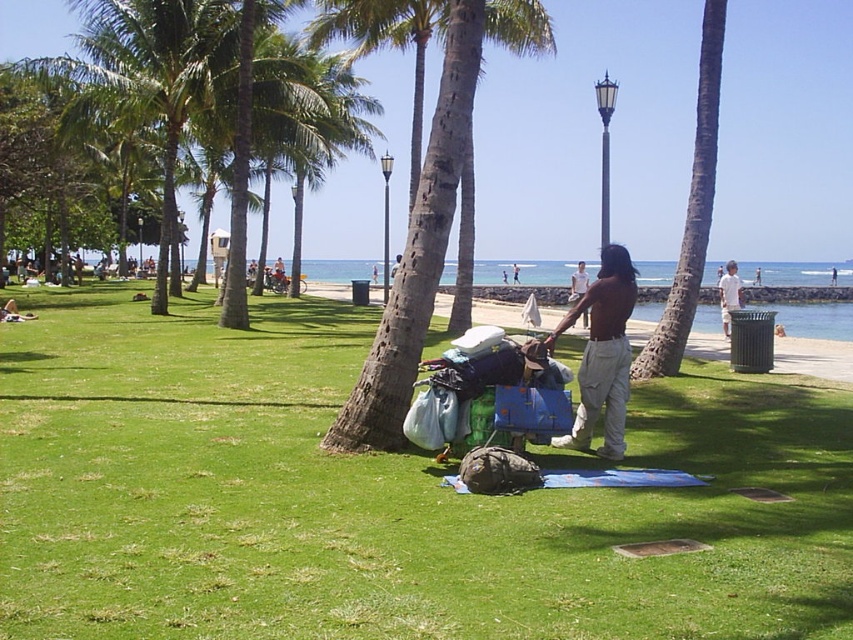
Question: Where is brown rough bark palm tree at center located in relation to brown hair at center in the image?

Choices:
 (A) below
 (B) above

Answer: (B)

Question: Which point is closer to the camera taking this photo?

Choices:
 (A) pyautogui.click(x=451, y=636)
 (B) pyautogui.click(x=612, y=428)
 (C) pyautogui.click(x=572, y=280)

Answer: (A)

Question: Can you confirm if brown rough bark palm tree at center is positioned above light brown cotton shirt at right?

Choices:
 (A) yes
 (B) no

Answer: (A)

Question: Among these points, which one is farthest from the camera?

Choices:
 (A) (624, 346)
 (B) (570, 276)
 (C) (730, 620)

Answer: (B)

Question: From the image, what is the correct spatial relationship of light brown cotton shirt at right in relation to brown cotton shirt at center?

Choices:
 (A) below
 (B) above

Answer: (A)

Question: Which object appears closest to the camera in this image?

Choices:
 (A) brown cotton shirt at center
 (B) brown hair at center
 (C) light brown cotton shirt at right

Answer: (B)